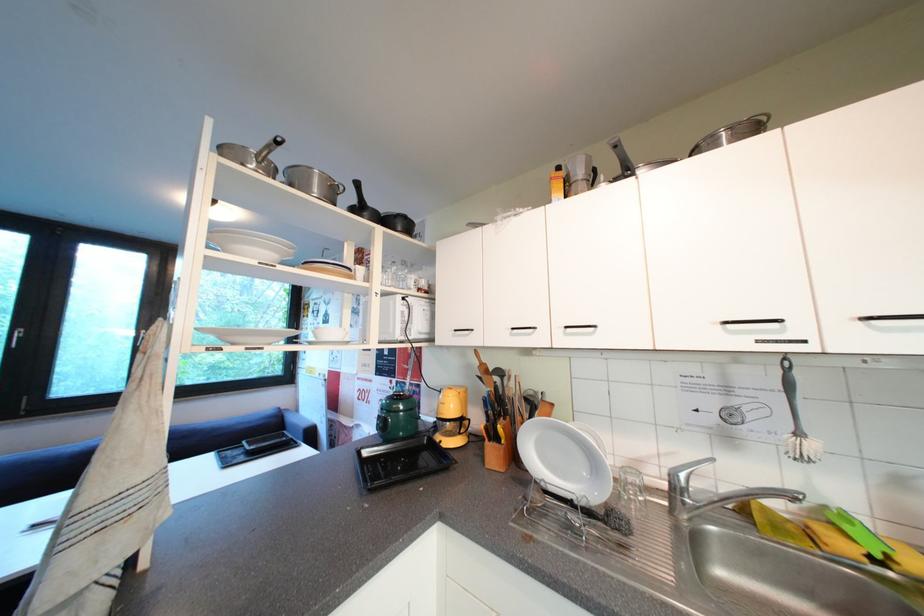
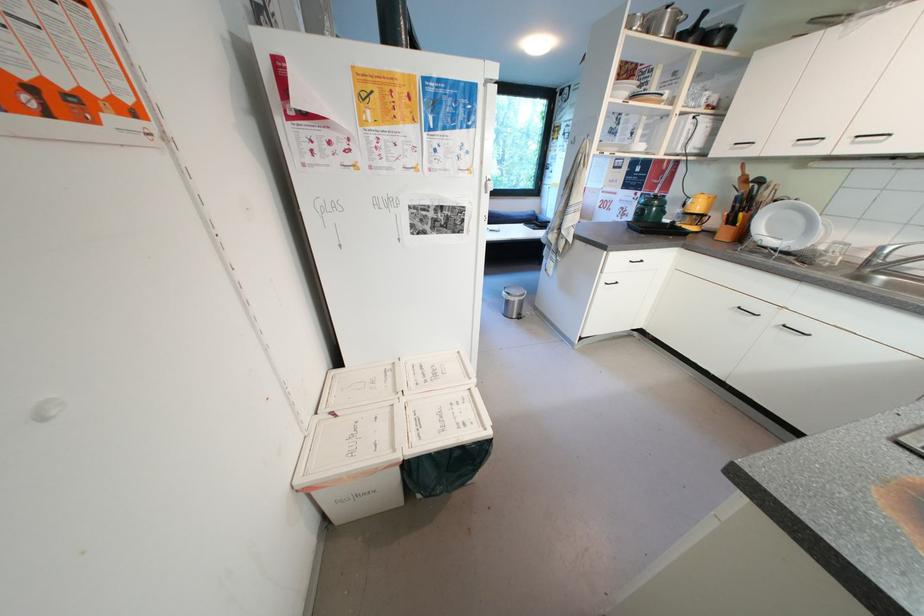
Find the pixel in the second image that matches (x=524, y=459) in the first image.

(749, 238)